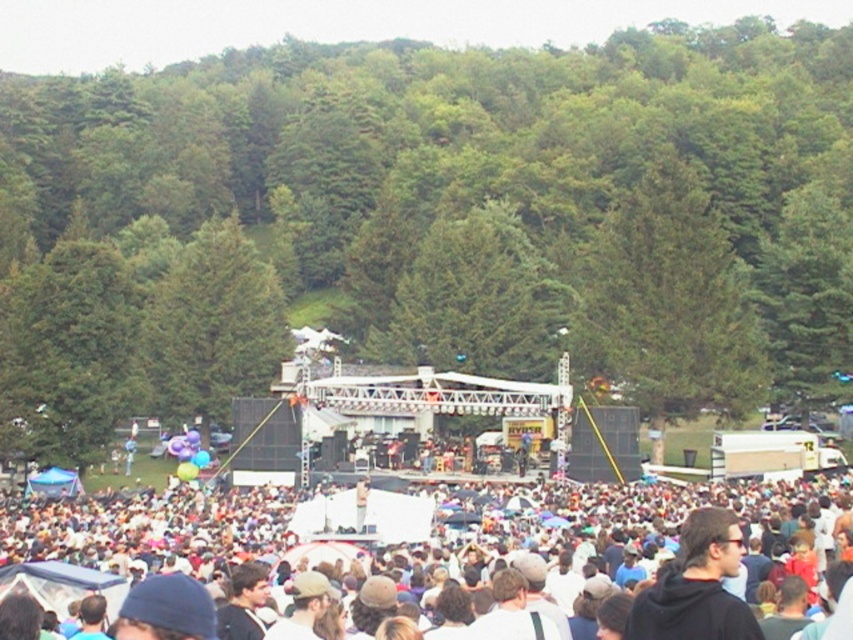
You are a photographer trying to capture a clear shot of the performers on stage. You notice two groups in the center of the image, the white cotton crowd at center and the black hoodie at center. Which group is closer to the front of the crowd, allowing for a better vantage point?

The black hoodie at center is taller than the white cotton crowd at center, so the black hoodie at center is closer to the front, providing a better vantage point.

You are standing at the point with coordinates (x=622, y=522) in the image. Based on the scene description, what object or area are you most likely standing in?

The point at coordinates (x=622, y=522) corresponds to the white cotton crowd at center, so you are standing in the crowd.